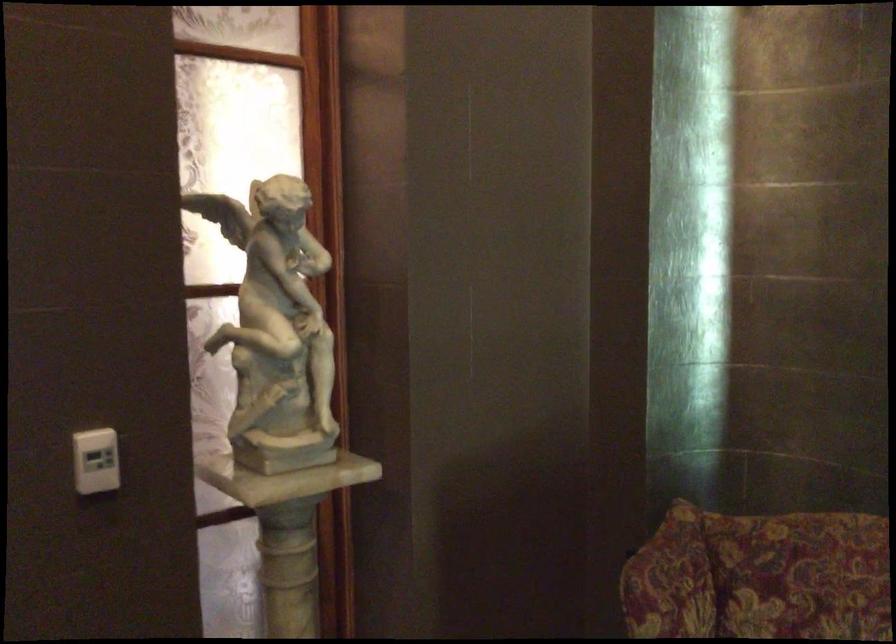
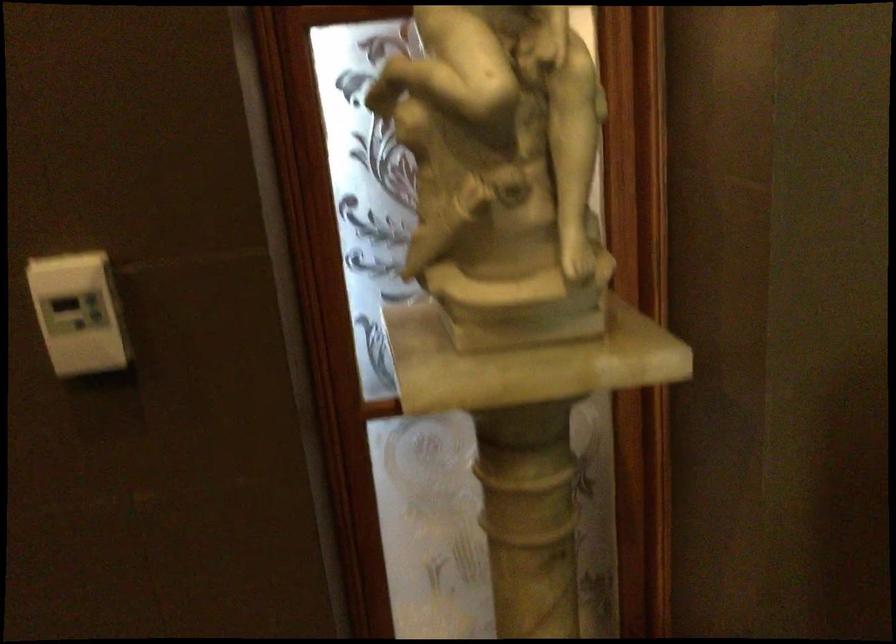
Question: The camera is either moving clockwise (left) or counter-clockwise (right) around the object. The first image is from the beginning of the video and the second image is from the end. Is the camera moving left or right when shooting the video?

Choices:
 (A) Left
 (B) Right

Answer: (B)